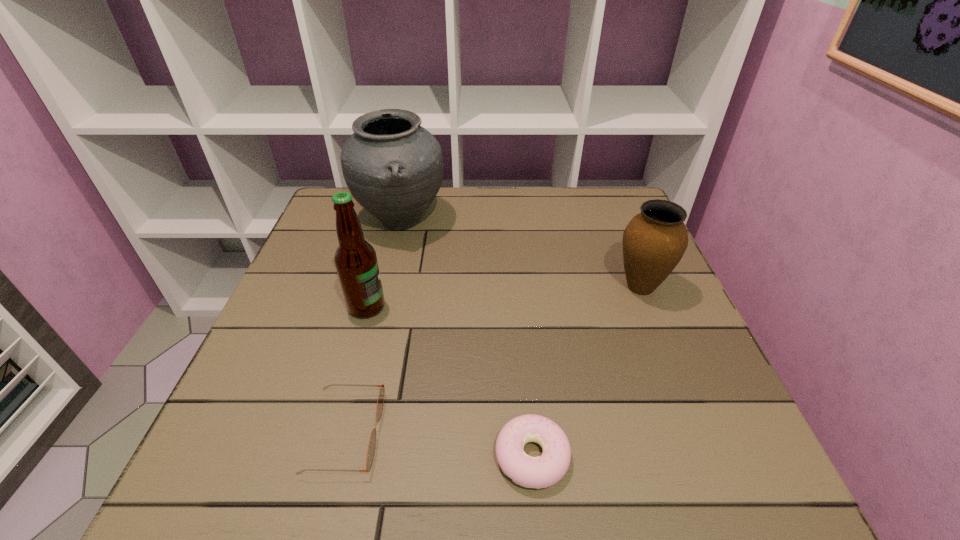
You are a GUI agent. You are given a task and a screenshot of the screen. Output one action in this format:
    pyautogui.click(x=<x>, y=<y>)
    Task: Click on the unoccupied area between the beer bottle and the farther urn
    
    Given the screenshot: What is the action you would take?
    pyautogui.click(x=384, y=264)

Where is `free area in between the beer bottle and the sunglasses`? free area in between the beer bottle and the sunglasses is located at coordinates click(356, 369).

Find the location of a particular element. The width and height of the screenshot is (960, 540). free point between the sunglasses and the nearer urn is located at coordinates (492, 360).

Image resolution: width=960 pixels, height=540 pixels. What are the coordinates of `free space between the taller urn and the beer bottle` in the screenshot? It's located at (384, 264).

Locate an element on the screen. The width and height of the screenshot is (960, 540). free space between the third shortest object and the sunglasses is located at coordinates (492, 360).

The height and width of the screenshot is (540, 960). I want to click on free area in between the sunglasses and the beer bottle, so click(356, 369).

Where is `unoccupied area between the sunglasses and the farthest object`? The height and width of the screenshot is (540, 960). unoccupied area between the sunglasses and the farthest object is located at coordinates (373, 327).

The height and width of the screenshot is (540, 960). I want to click on the third closest object to the taller urn, so click(372, 442).

Point out which object is positioned as the nearest to the doughnut. Please provide its 2D coordinates. Your answer should be formatted as a tuple, i.e. [(x, y)], where the tuple contains the x and y coordinates of a point satisfying the conditions above.

[(372, 442)]

Locate an element on the screen. The image size is (960, 540). free spot that satisfies the following two spatial constraints: 1. on the label of the beer bottle; 2. on the left side of the second object from right to left is located at coordinates (326, 456).